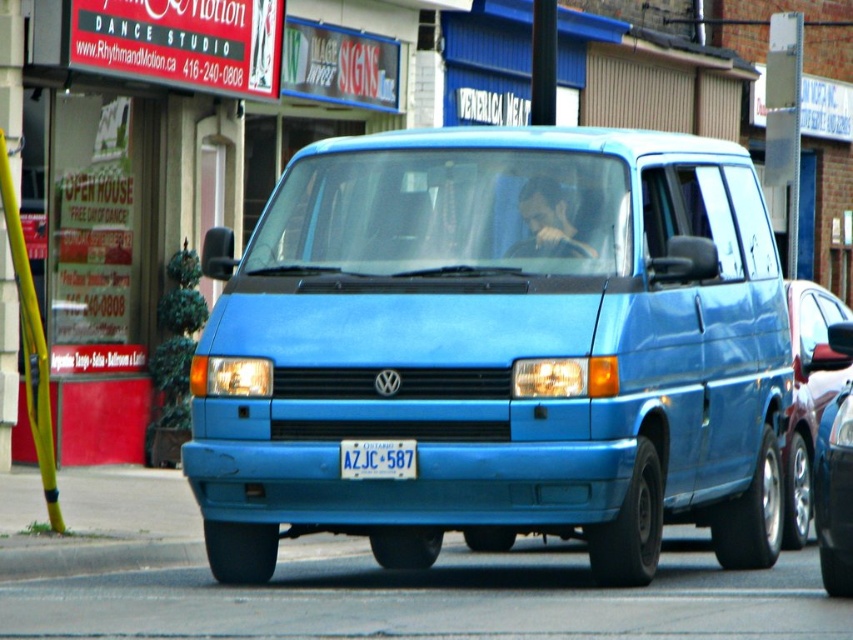
Question: Which point appears farthest from the camera in this image?

Choices:
 (A) (809, 492)
 (B) (387, 444)

Answer: (A)

Question: Is matte blue van at center in front of blue matte van at center?

Choices:
 (A) yes
 (B) no

Answer: (A)

Question: Is blue matte van at center to the left of white plastic license plate at center from the viewer's perspective?

Choices:
 (A) yes
 (B) no

Answer: (B)

Question: Which of the following is the farthest from the observer?

Choices:
 (A) (410, 234)
 (B) (372, 465)

Answer: (A)

Question: In this image, where is matte blue van at center located relative to blue matte van at center?

Choices:
 (A) below
 (B) above

Answer: (B)

Question: Which object is positioned farthest from the blue matte van at center?

Choices:
 (A) white plastic license plate at center
 (B) matte blue van at center

Answer: (A)